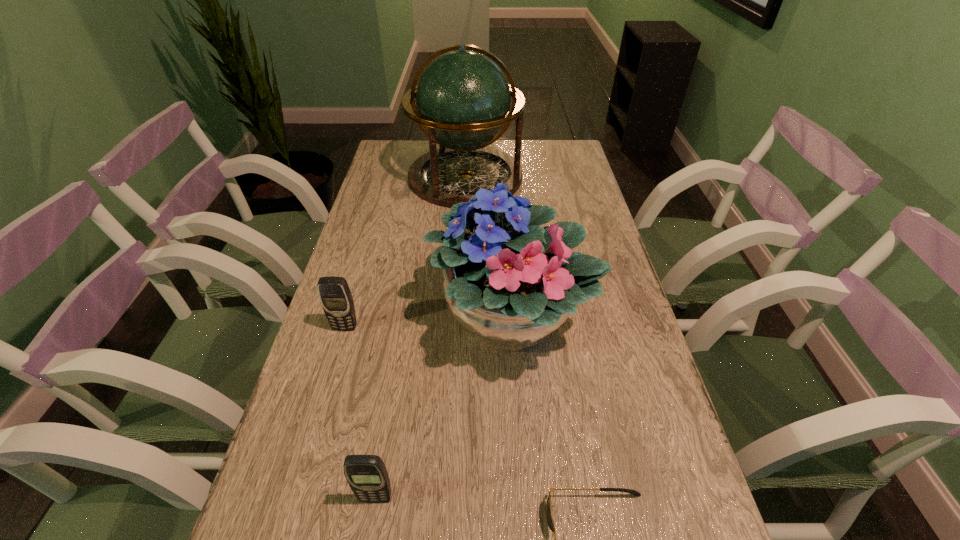
Identify which object is located as the nearest to the bouquet. Please provide its 2D coordinates. Your answer should be formatted as a tuple, i.e. [(x, y)], where the tuple contains the x and y coordinates of a point satisfying the conditions above.

[(335, 296)]

You are a GUI agent. You are given a task and a screenshot of the screen. Output one action in this format:
    pyautogui.click(x=<x>, y=<y>)
    Task: Click on the closest object to the farther cellular telephone
    
    Given the screenshot: What is the action you would take?
    pyautogui.click(x=510, y=284)

What are the coordinates of `free location that satisfies the following two spatial constraints: 1. on the front-facing side of the bouquet; 2. on the right side of the tallest object` in the screenshot? It's located at (459, 320).